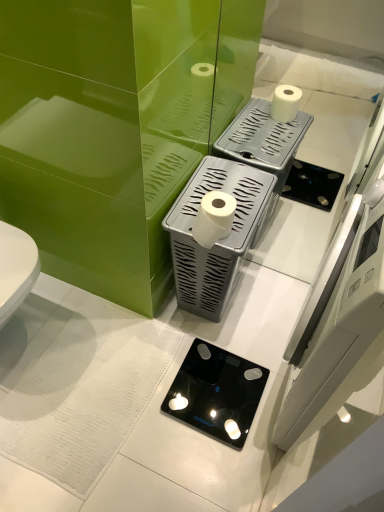
How much space does black glass scale at center, the second appliance when ordered from top to bottom, occupy horizontally?

black glass scale at center, the second appliance when ordered from top to bottom, is 29.36 centimeters in width.

Describe the element at coordinates (219, 239) in the screenshot. I see `white plastic toilet paper holder at center, which is counted as the 2th appliance, starting from the bottom` at that location.

Locate an element on the screen. black glass scale at center, marked as the 1th appliance in a bottom-to-top arrangement is located at coordinates (216, 393).

Does point (197, 240) come in front of point (161, 408)?

That is True.

Considering the sizes of objects white matte toilet paper at center and black glass scale at center, marked as the 1th appliance in a bottom-to-top arrangement, in the image provided, who is wider, white matte toilet paper at center or black glass scale at center, marked as the 1th appliance in a bottom-to-top arrangement,?

With larger width is black glass scale at center, marked as the 1th appliance in a bottom-to-top arrangement.

Is white matte toilet paper at center oriented towards black glass scale at center, the second appliance when ordered from top to bottom?

No, white matte toilet paper at center is not turned towards black glass scale at center, the second appliance when ordered from top to bottom.

Does point (212, 194) appear closer or farther from the camera than point (257, 214)?

Point (212, 194).

How many degrees apart are the facing directions of white matte toilet paper at center and white plastic toilet paper holder at center, the first appliance viewed from the top?

The facing directions of white matte toilet paper at center and white plastic toilet paper holder at center, the first appliance viewed from the top, are 0.000447 degrees apart.

From a real-world perspective, is white matte toilet paper at center under white plastic toilet paper holder at center, the first appliance viewed from the top?

Incorrect, from a real-world perspective, white matte toilet paper at center is higher than white plastic toilet paper holder at center, the first appliance viewed from the top.

From the picture: Is the position of white matte toilet paper at center more distant than that of white plastic toilet paper holder at center, which is counted as the 2th appliance, starting from the bottom?

No, it is not.

Is black glass scale at center, the second appliance when ordered from top to bottom, wider than white matte toilet paper at center?

Correct, the width of black glass scale at center, the second appliance when ordered from top to bottom, exceeds that of white matte toilet paper at center.

Are black glass scale at center, the second appliance when ordered from top to bottom, and white matte toilet paper at center beside each other?

No, black glass scale at center, the second appliance when ordered from top to bottom, is not in contact with white matte toilet paper at center.

From a real-world perspective, is black glass scale at center, marked as the 1th appliance in a bottom-to-top arrangement, physically above white matte toilet paper at center?

Incorrect, from a real-world perspective, black glass scale at center, marked as the 1th appliance in a bottom-to-top arrangement, is lower than white matte toilet paper at center.

Considering the relative positions of black glass scale at center, the second appliance when ordered from top to bottom, and white matte toilet paper at center in the image provided, is black glass scale at center, the second appliance when ordered from top to bottom, to the left of white matte toilet paper at center from the viewer's perspective?

In fact, black glass scale at center, the second appliance when ordered from top to bottom, is to the right of white matte toilet paper at center.

Which object is positioned more to the right, white plastic toilet paper holder at center, the first appliance viewed from the top, or black glass scale at center, the second appliance when ordered from top to bottom?

Positioned to the right is white plastic toilet paper holder at center, the first appliance viewed from the top.

Is white plastic toilet paper holder at center, which is counted as the 2th appliance, starting from the bottom, shorter than black glass scale at center, the second appliance when ordered from top to bottom?

No, white plastic toilet paper holder at center, which is counted as the 2th appliance, starting from the bottom, is not shorter than black glass scale at center, the second appliance when ordered from top to bottom.

From a real-world perspective, between white plastic toilet paper holder at center, the first appliance viewed from the top, and black glass scale at center, marked as the 1th appliance in a bottom-to-top arrangement, who is vertically lower?

From a 3D spatial view, black glass scale at center, marked as the 1th appliance in a bottom-to-top arrangement, is below.

Is white plastic toilet paper holder at center, the first appliance viewed from the top, surrounded by black glass scale at center, marked as the 1th appliance in a bottom-to-top arrangement?

Definitely not — white plastic toilet paper holder at center, the first appliance viewed from the top, is not inside black glass scale at center, marked as the 1th appliance in a bottom-to-top arrangement.

Considering the sizes of objects black glass scale at center, the second appliance when ordered from top to bottom, and white plastic toilet paper holder at center, the first appliance viewed from the top, in the image provided, who is wider, black glass scale at center, the second appliance when ordered from top to bottom, or white plastic toilet paper holder at center, the first appliance viewed from the top,?

black glass scale at center, the second appliance when ordered from top to bottom.

Is black glass scale at center, marked as the 1th appliance in a bottom-to-top arrangement, at the right side of white plastic toilet paper holder at center, the first appliance viewed from the top?

No, black glass scale at center, marked as the 1th appliance in a bottom-to-top arrangement, is not to the right of white plastic toilet paper holder at center, the first appliance viewed from the top.

Based on the photo, is black glass scale at center, marked as the 1th appliance in a bottom-to-top arrangement, positioned in front of white plastic toilet paper holder at center, the first appliance viewed from the top?

That is False.

Is point (203, 259) closer or farther from the camera than point (222, 195)?

Point (203, 259).

Would you say white plastic toilet paper holder at center, the first appliance viewed from the top, is to the left or to the right of white matte toilet paper at center in the picture?

white plastic toilet paper holder at center, the first appliance viewed from the top, is positioned on white matte toilet paper at center's right side.

Considering the sizes of objects white plastic toilet paper holder at center, which is counted as the 2th appliance, starting from the bottom, and white matte toilet paper at center in the image provided, who is smaller, white plastic toilet paper holder at center, which is counted as the 2th appliance, starting from the bottom, or white matte toilet paper at center?

white matte toilet paper at center.

Find the location of a particular element. This screenshot has width=384, height=512. appliance that is the 2nd object directly below the white matte toilet paper at center (from a real-world perspective) is located at coordinates (216, 393).

From the image's perspective, count 1st appliances downward from the white matte toilet paper at center and point to it. Please provide its 2D coordinates.

[(219, 239)]

Which object lies nearer to the anchor point white matte toilet paper at center, black glass scale at center, marked as the 1th appliance in a bottom-to-top arrangement, or white plastic toilet paper holder at center, which is counted as the 2th appliance, starting from the bottom?

white plastic toilet paper holder at center, which is counted as the 2th appliance, starting from the bottom, is closer to white matte toilet paper at center.

Estimate the real-world distances between objects in this image. Which object is closer to white matte toilet paper at center, white plastic toilet paper holder at center, which is counted as the 2th appliance, starting from the bottom, or black glass scale at center, marked as the 1th appliance in a bottom-to-top arrangement?

Based on the image, white plastic toilet paper holder at center, which is counted as the 2th appliance, starting from the bottom, appears to be nearer to white matte toilet paper at center.

Looking at the image, which one is located closer to white plastic toilet paper holder at center, the first appliance viewed from the top, black glass scale at center, the second appliance when ordered from top to bottom, or white matte toilet paper at center?

Among the two, white matte toilet paper at center is located nearer to white plastic toilet paper holder at center, the first appliance viewed from the top.

Looking at the image, which one is located further to black glass scale at center, marked as the 1th appliance in a bottom-to-top arrangement, white plastic toilet paper holder at center, the first appliance viewed from the top, or white matte toilet paper at center?

The object further to black glass scale at center, marked as the 1th appliance in a bottom-to-top arrangement, is white matte toilet paper at center.

Looking at the image, which one is located closer to white plastic toilet paper holder at center, the first appliance viewed from the top, white matte toilet paper at center or black glass scale at center, marked as the 1th appliance in a bottom-to-top arrangement?

white matte toilet paper at center is positioned closer to the anchor white plastic toilet paper holder at center, the first appliance viewed from the top.

When comparing their distances from black glass scale at center, marked as the 1th appliance in a bottom-to-top arrangement, does white matte toilet paper at center or white plastic toilet paper holder at center, which is counted as the 2th appliance, starting from the bottom, seem further?

white matte toilet paper at center is positioned further to the anchor black glass scale at center, marked as the 1th appliance in a bottom-to-top arrangement.

At what (x,y) coordinates should I click in order to perform the action: click on appliance that lies between white matte toilet paper at center and black glass scale at center, marked as the 1th appliance in a bottom-to-top arrangement, from top to bottom. Please return your answer as a coordinate pair (x, y). This screenshot has height=512, width=384. Looking at the image, I should click on (219, 239).